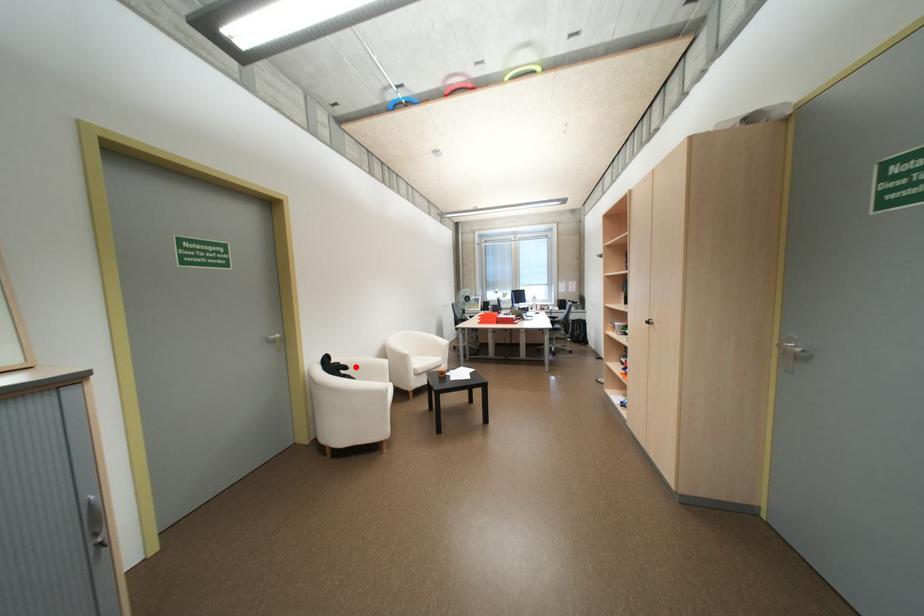
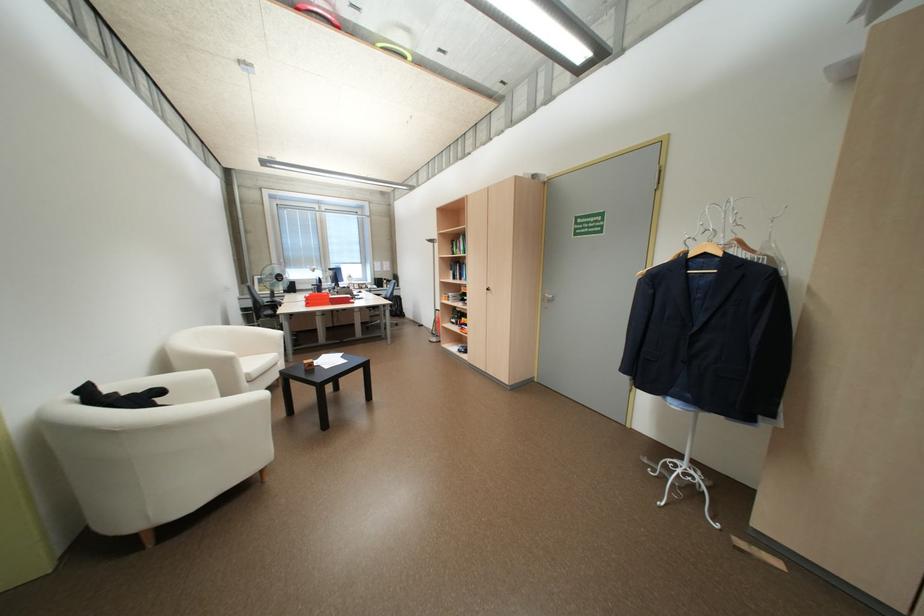
Question: I am providing you with two images of the same scene from different viewpoints. A red point is shown in image1. For the corresponding object point in image2, is it positioned nearer or farther from the camera?

Choices:
 (A) Nearer
 (B) Farther

Answer: (B)